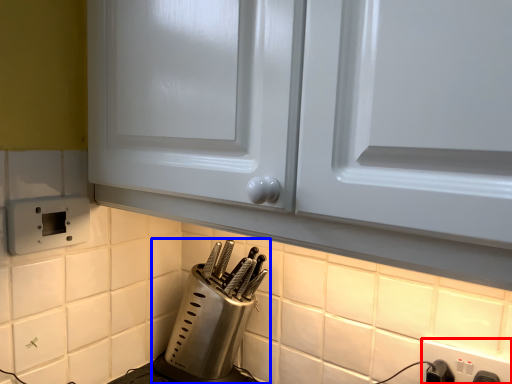
Question: Which object is further to the camera taking this photo, electric outlet (highlighted by a red box) or kitchen appliance (highlighted by a blue box)?

Choices:
 (A) electric outlet
 (B) kitchen appliance

Answer: (B)